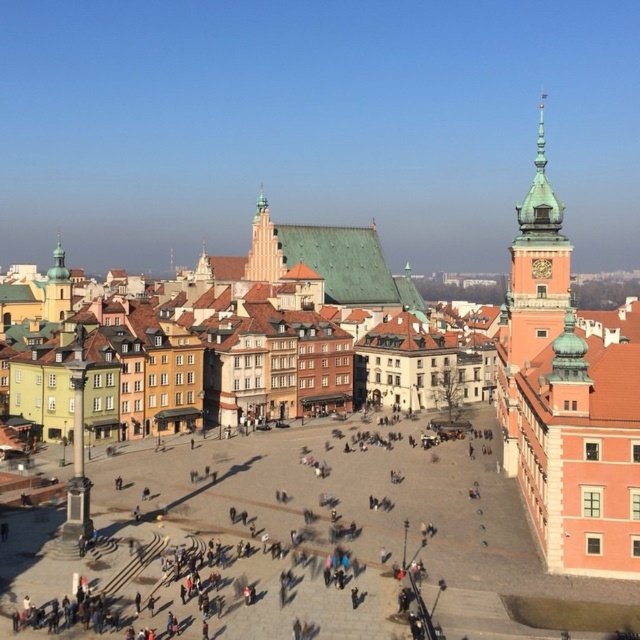
You are a tourist standing in the square and want to take a photo that includes both the green matte tower at upper right and the light beige stone tower at center. Which tower should you position closer to the camera to ensure both are fully visible in the frame?

To ensure both the green matte tower at upper right and the light beige stone tower at center are fully visible, position the light beige stone tower at center closer to the camera since it is smaller in size compared to the green matte tower at upper right.

You are a tourist standing in the square and want to take a photo of both the green matte tower at upper right and the light beige stone tower at center. Which tower should you position to your left to include both in the frame?

You should position the light beige stone tower at center to your left because the green matte tower at upper right is to the right of it, so arranging them with the light beige one on your left would place both in the frame.